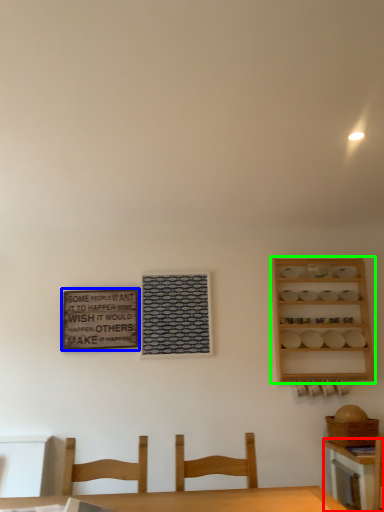
Question: Which is farther away from table (highlighted by a red box)? bulletin board (highlighted by a blue box) or shelf (highlighted by a green box)?

Choices:
 (A) bulletin board
 (B) shelf

Answer: (A)